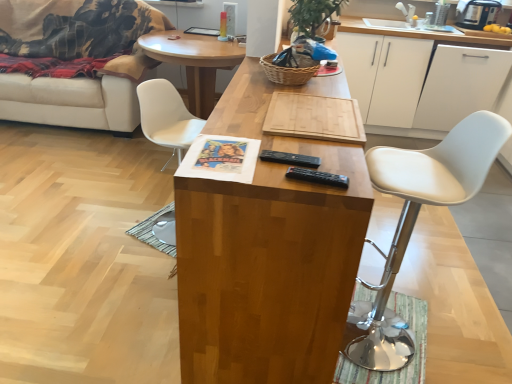
You are a GUI agent. You are given a task and a screenshot of the screen. Output one action in this format:
    pyautogui.click(x=<x>, y=<y>)
    Task: Click on the free space to the left of wooden cutting board at center, which is the 1th coffee table in front-to-back order
    The width and height of the screenshot is (512, 384).
    Given the screenshot: What is the action you would take?
    pyautogui.click(x=98, y=262)